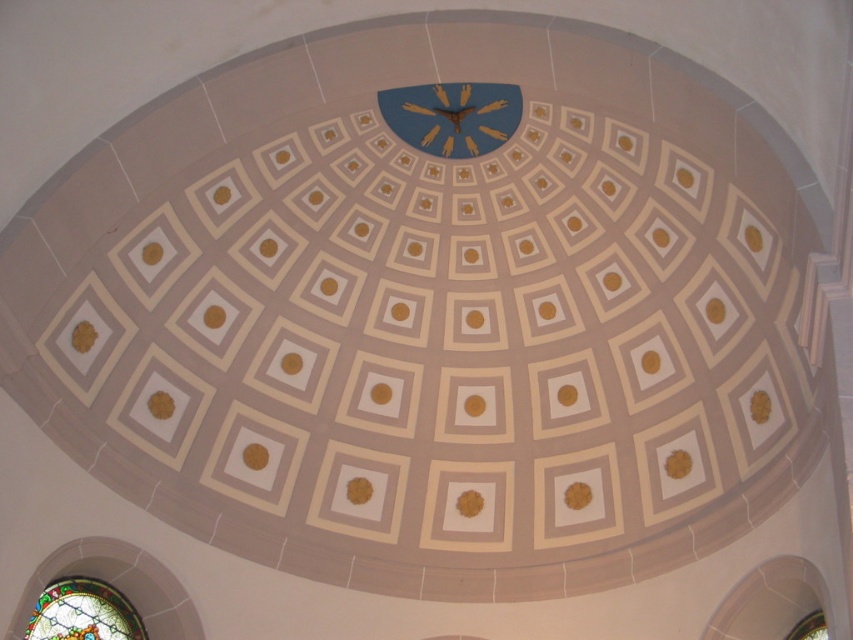
Between blue matte clock at center and stained glass window at lower left, which one is positioned lower?

stained glass window at lower left

Who is more distant from viewer, (421, 132) or (103, 632)?

Positioned behind is point (421, 132).

Where is `blue matte clock at center`? This screenshot has height=640, width=853. blue matte clock at center is located at coordinates (451, 116).